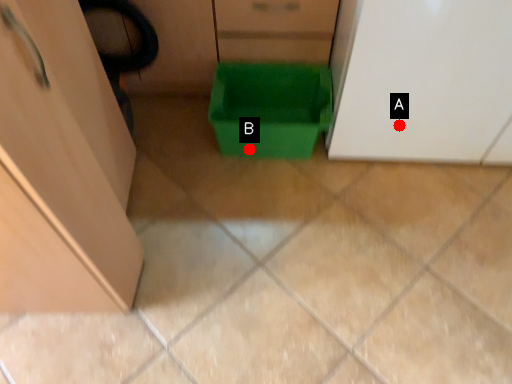
Question: Two points are circled on the image, labeled by A and B beside each circle. Which point is closer to the camera?

Choices:
 (A) A is closer
 (B) B is closer

Answer: (A)